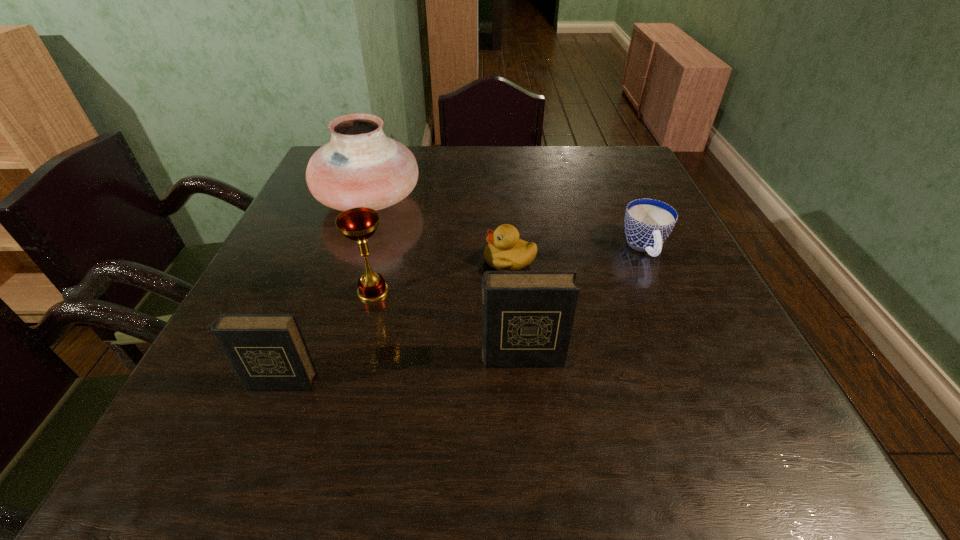
What are the coordinates of `the nearest object` in the screenshot? It's located at (268, 351).

Locate an element on the screen. Image resolution: width=960 pixels, height=540 pixels. the left diary is located at coordinates (268, 351).

Identify the location of the right diary. The image size is (960, 540). (527, 316).

This screenshot has height=540, width=960. I want to click on the taller diary, so click(x=527, y=316).

The width and height of the screenshot is (960, 540). Identify the location of chalice. [x=358, y=224].

Identify the location of duckling. The image size is (960, 540). (505, 252).

Where is `pottery`? pottery is located at coordinates (360, 167).

What are the coordinates of `the rightmost object` in the screenshot? It's located at (648, 222).

This screenshot has height=540, width=960. What are the coordinates of `vacant area located 0.050m on the front cover of the right diary` in the screenshot? It's located at (525, 393).

In order to click on vacant area situated on the right of the chalice in this screenshot , I will do `click(494, 292)`.